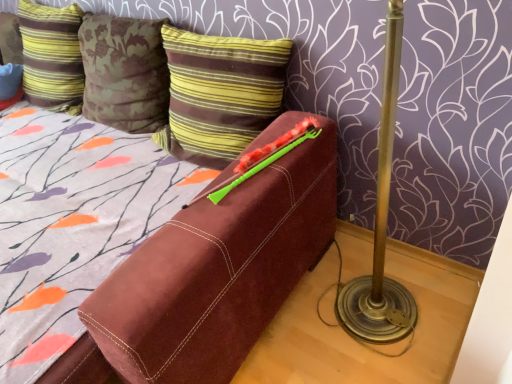
Question: Is green plastic crayon at upper center far from striped velvet pillow at upper left, which is the second pillow from right to left?

Choices:
 (A) no
 (B) yes

Answer: (B)

Question: Is green plastic crayon at upper center surrounding striped velvet pillow at upper left, which ranks as the 1th pillow in left-to-right order?

Choices:
 (A) no
 (B) yes

Answer: (A)

Question: From a real-world perspective, is green plastic crayon at upper center over striped velvet pillow at upper left, which is the second pillow from right to left?

Choices:
 (A) yes
 (B) no

Answer: (B)

Question: Can you confirm if green plastic crayon at upper center is thinner than striped velvet pillow at upper left, which ranks as the 1th pillow in left-to-right order?

Choices:
 (A) no
 (B) yes

Answer: (A)

Question: Considering the relative positions of green plastic crayon at upper center and striped velvet pillow at upper left, which ranks as the 1th pillow in left-to-right order, in the image provided, is green plastic crayon at upper center to the left of striped velvet pillow at upper left, which ranks as the 1th pillow in left-to-right order, from the viewer's perspective?

Choices:
 (A) no
 (B) yes

Answer: (A)

Question: Based on their positions, is brown striped pillow at upper center, the second pillow in the left-to-right sequence, located to the left or right of green plastic crayon at upper center?

Choices:
 (A) left
 (B) right

Answer: (A)

Question: From the image's perspective, is brown striped pillow at upper center, the second pillow in the left-to-right sequence, positioned above or below green plastic crayon at upper center?

Choices:
 (A) below
 (B) above

Answer: (B)

Question: In the image, is brown striped pillow at upper center, the second pillow in the left-to-right sequence, positioned in front of or behind green plastic crayon at upper center?

Choices:
 (A) behind
 (B) front

Answer: (A)

Question: Is point pyautogui.click(x=196, y=57) positioned closer to the camera than point pyautogui.click(x=283, y=144)?

Choices:
 (A) farther
 (B) closer

Answer: (A)

Question: Considering the positions of point (19, 21) and point (215, 193), is point (19, 21) closer or farther from the camera than point (215, 193)?

Choices:
 (A) farther
 (B) closer

Answer: (A)

Question: Considering their positions, is striped velvet pillow at upper left, which ranks as the 1th pillow in left-to-right order, located in front of or behind green plastic crayon at upper center?

Choices:
 (A) front
 (B) behind

Answer: (B)

Question: From their relative heights in the image, would you say striped velvet pillow at upper left, which is the second pillow from right to left, is taller or shorter than green plastic crayon at upper center?

Choices:
 (A) tall
 (B) short

Answer: (A)

Question: From a real-world perspective, is striped velvet pillow at upper left, which ranks as the 1th pillow in left-to-right order, physically located above or below green plastic crayon at upper center?

Choices:
 (A) below
 (B) above

Answer: (B)

Question: Is point (41, 41) positioned closer to the camera than point (225, 127)?

Choices:
 (A) closer
 (B) farther

Answer: (B)

Question: In the image, is striped velvet pillow at upper left, which ranks as the 1th pillow in left-to-right order, positioned in front of or behind brown striped pillow at upper center, the second pillow in the left-to-right sequence?

Choices:
 (A) front
 (B) behind

Answer: (B)